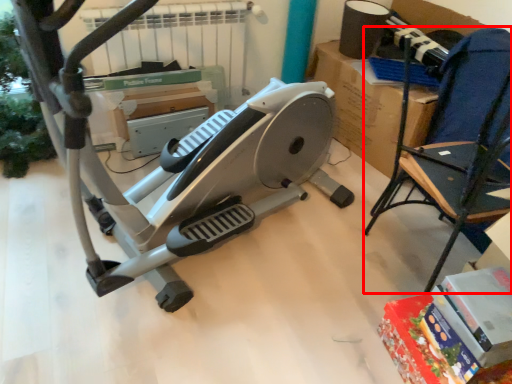
Question: From the image's perspective, what is the correct spatial relationship of chair (annotated by the red box) in relation to stationary bicycle?

Choices:
 (A) below
 (B) above

Answer: (A)